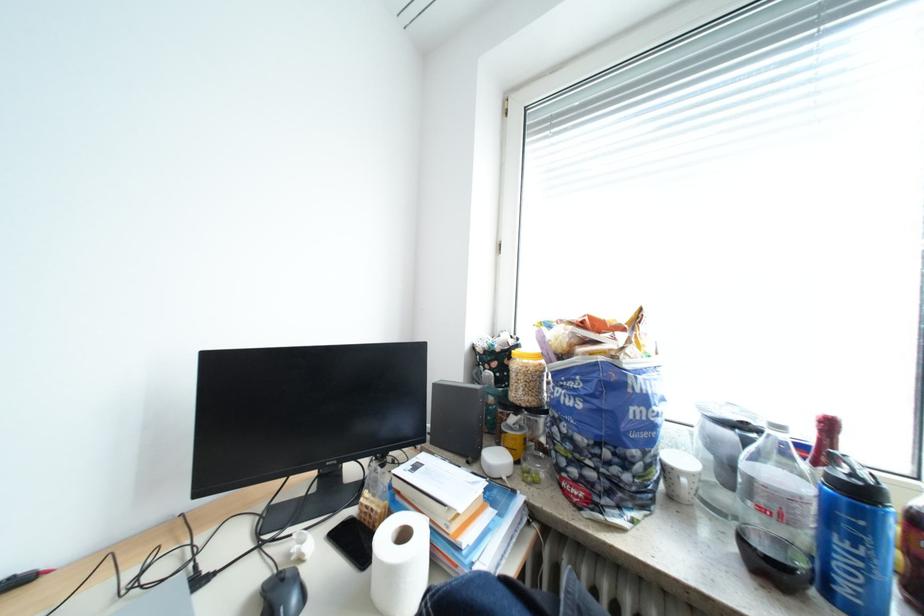
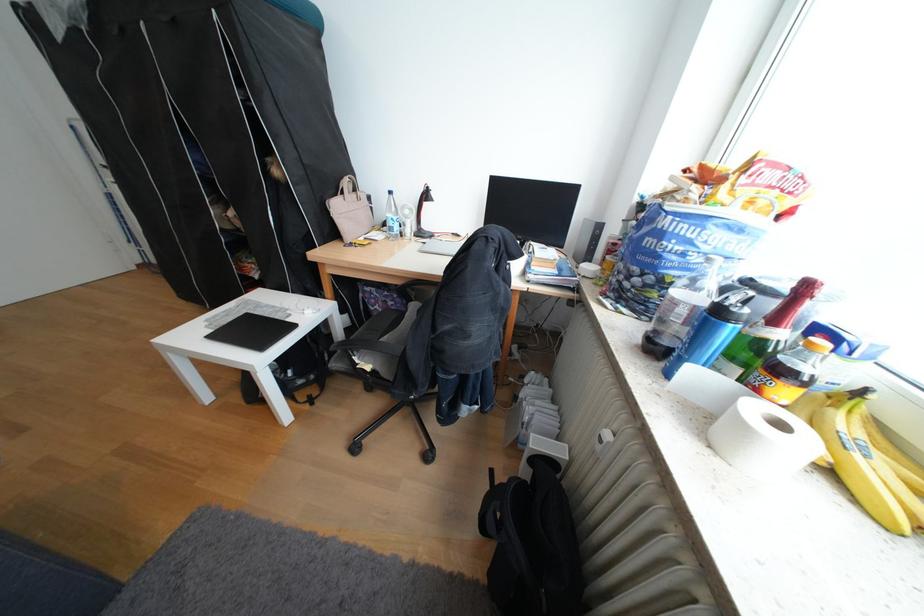
The point at (843, 426) is marked in the first image. Where is the corresponding point in the second image?

(819, 288)